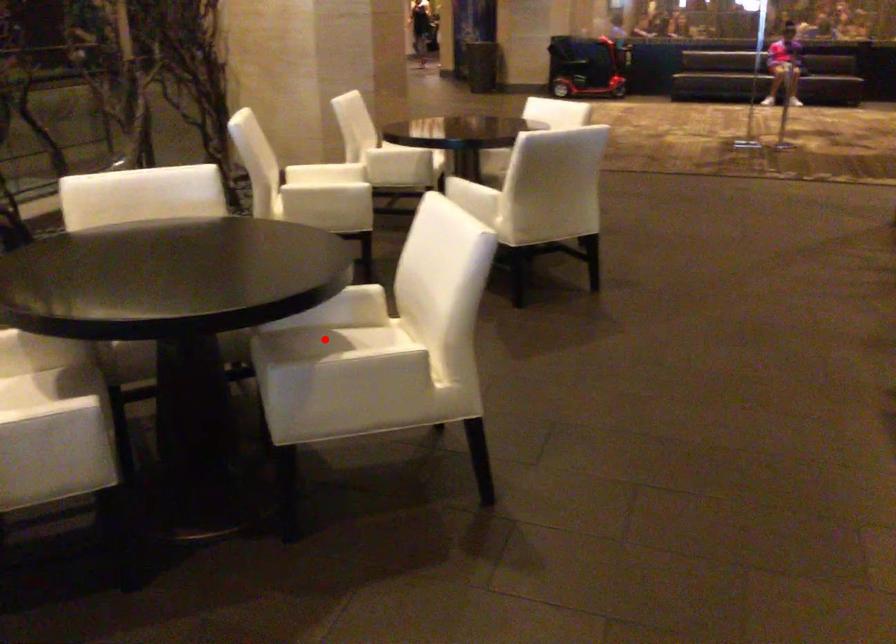
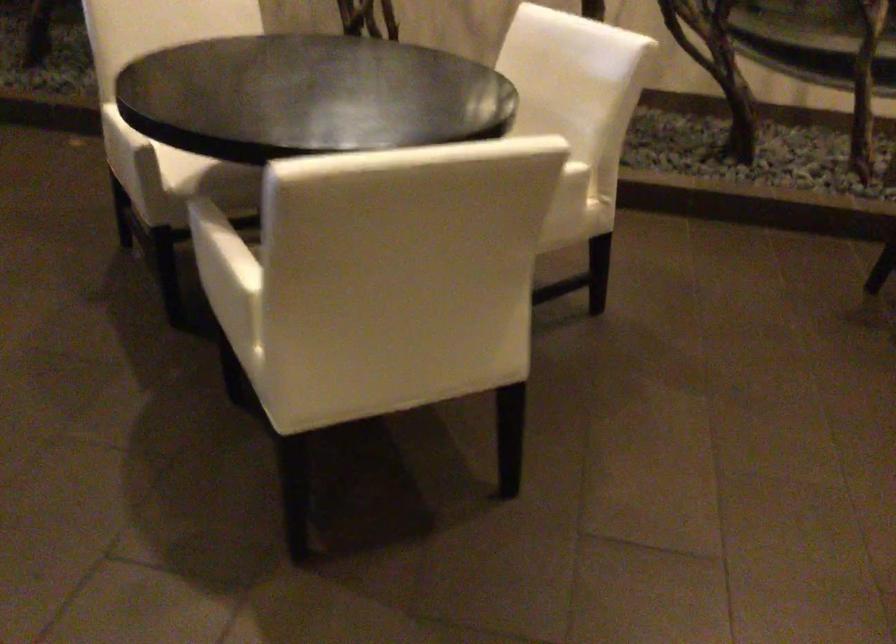
Question: I am providing you with two images of the same scene from different viewpoints. A red point is marked on the first image. At the location where the point appears in image 1, is it still visible in image 2?

Choices:
 (A) Yes
 (B) No

Answer: (B)